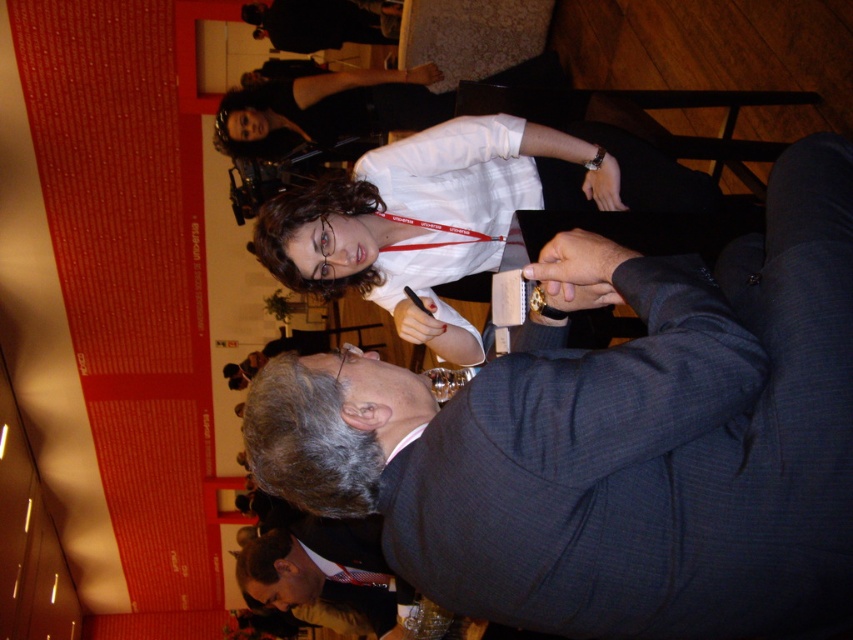
You are standing at the back of the room and want to see the man in the dark gray suit at lower center. Is the white shirt at center blocking your view of him?

The white shirt at center is taller than dark gray suit at lower center, so yes, the white shirt at center is blocking your view of the dark gray suit at lower center.

You are standing at the entrance of the event venue and want to approach both the dark blue suit at center and the dark gray suit at lower center. Given that the average walking distance between people in such events is about 10 feet, can you comfortably walk between them without feeling too crowded?

The dark blue suit at center is 9.49 feet away from the dark gray suit at lower center. Since the average walking distance is about 10 feet, the distance between them is slightly less than the average, so walking between them might feel a bit crowded but still manageable.

You are a photographer at this event and need to take a group photo. The dark blue suit at center and the white shirt at center are currently overlapping. Which one should you ask to move slightly to the side to avoid covering the other?

The dark blue suit at center is thinner than the white shirt at center, so the white shirt at center should move slightly to the side to avoid covering the thinner dark blue suit at center.